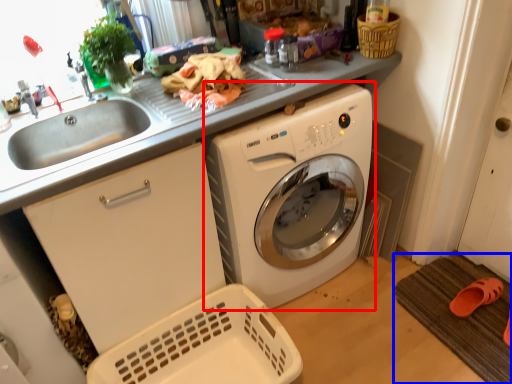
Question: Which of the following is the farthest to the observer, washing machine (highlighted by a red box) or bath mat (highlighted by a blue box)?

Choices:
 (A) washing machine
 (B) bath mat

Answer: (B)